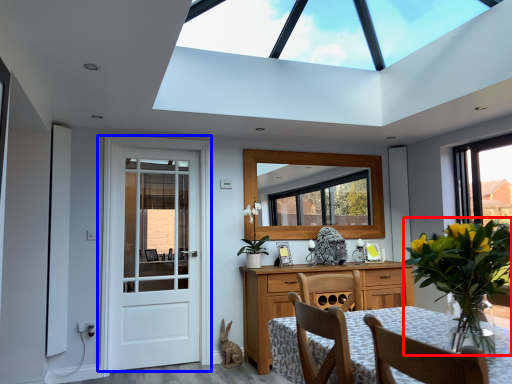
Question: Which object is closer to the camera taking this photo, floral arrangement (highlighted by a red box) or door (highlighted by a blue box)?

Choices:
 (A) floral arrangement
 (B) door

Answer: (A)